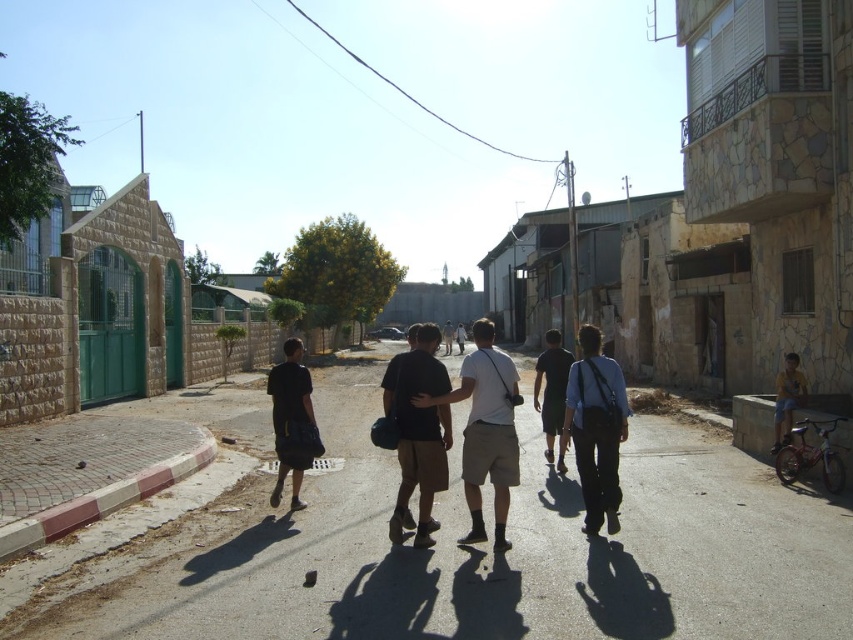
Who is positioned more to the right, dark gray cotton t-shirt at center or dark brown leather backpack at center?

dark gray cotton t-shirt at center

Is dark gray cotton t-shirt at center closer to camera compared to dark brown leather backpack at center?

Yes.

Which is in front, point (498, 490) or point (407, 458)?

Positioned in front is point (498, 490).

The width and height of the screenshot is (853, 640). In order to click on dark gray cotton t-shirt at center in this screenshot , I will do `click(486, 429)`.

Can you confirm if smooth concrete alley at center is bigger than dark gray fabric pants at center?

No.

Does smooth concrete alley at center have a greater height compared to dark gray fabric pants at center?

Incorrect, smooth concrete alley at center's height is not larger of dark gray fabric pants at center's.

Based on the photo, who is more forward, (355,608) or (553,422)?

Point (355,608) is more forward.

You are a GUI agent. You are given a task and a screenshot of the screen. Output one action in this format:
    pyautogui.click(x=<x>, y=<y>)
    Task: Click on the smooth concrete alley at center
    
    Given the screenshot: What is the action you would take?
    pyautogui.click(x=502, y=554)

Between point (434, 356) and point (798, 381), which one is positioned in front?

Point (434, 356)

Does point (419, 458) come closer to viewer compared to point (802, 378)?

Yes, point (419, 458) is in front of point (802, 378).

This screenshot has width=853, height=640. I want to click on dark brown leather backpack at center, so click(x=418, y=432).

I want to click on dark brown leather backpack at center, so click(x=418, y=432).